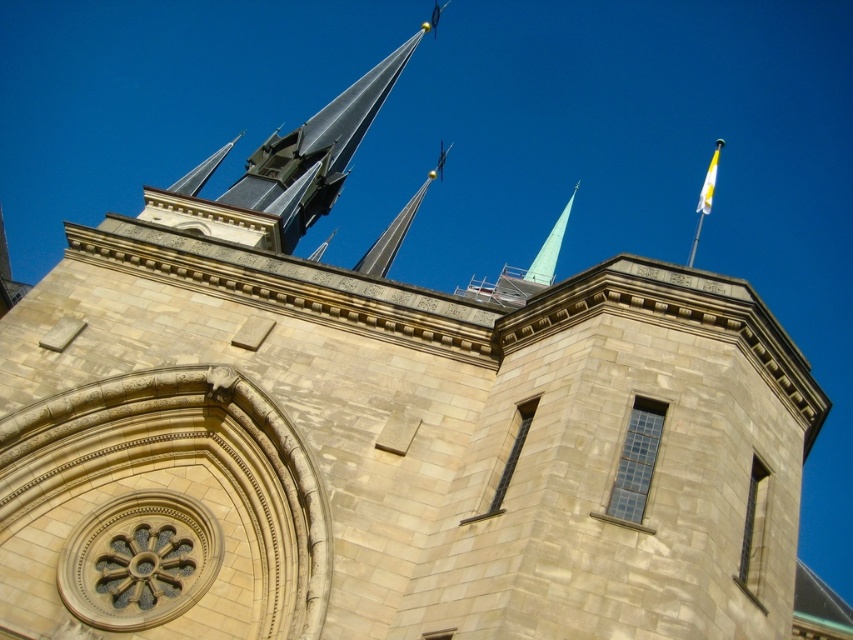
Question: Which point is farther from the camera taking this photo?

Choices:
 (A) pyautogui.click(x=363, y=269)
 (B) pyautogui.click(x=538, y=259)

Answer: (B)

Question: Is shiny metallic spire at center to the left of light blue glass spire at upper center from the viewer's perspective?

Choices:
 (A) yes
 (B) no

Answer: (A)

Question: Which object is the closest to the shiny metallic spire at center?

Choices:
 (A) yellow fabric flag at upper right
 (B) light blue glass spire at upper center

Answer: (B)

Question: Which point is farther to the camera?

Choices:
 (A) (408, 225)
 (B) (537, 272)

Answer: (B)

Question: Does shiny metallic spire at center come behind yellow fabric flag at upper right?

Choices:
 (A) no
 (B) yes

Answer: (A)

Question: Does shiny metallic spire at center lie behind yellow fabric flag at upper right?

Choices:
 (A) no
 (B) yes

Answer: (A)